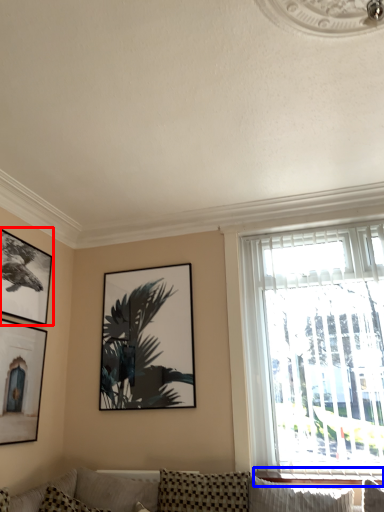
Question: Among these objects, which one is farthest to the camera, picture frame (highlighted by a red box) or window sill (highlighted by a blue box)?

Choices:
 (A) picture frame
 (B) window sill

Answer: (A)